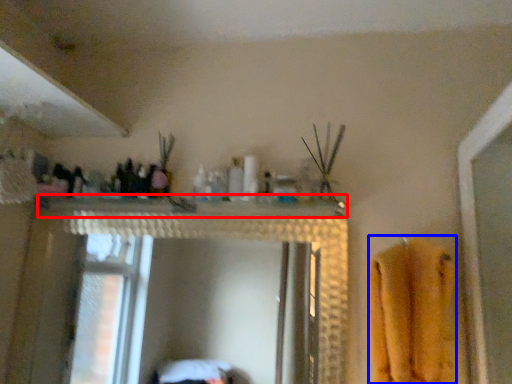
Question: Which object is closer to the camera taking this photo, counter top (highlighted by a red box) or bath towel (highlighted by a blue box)?

Choices:
 (A) counter top
 (B) bath towel

Answer: (B)